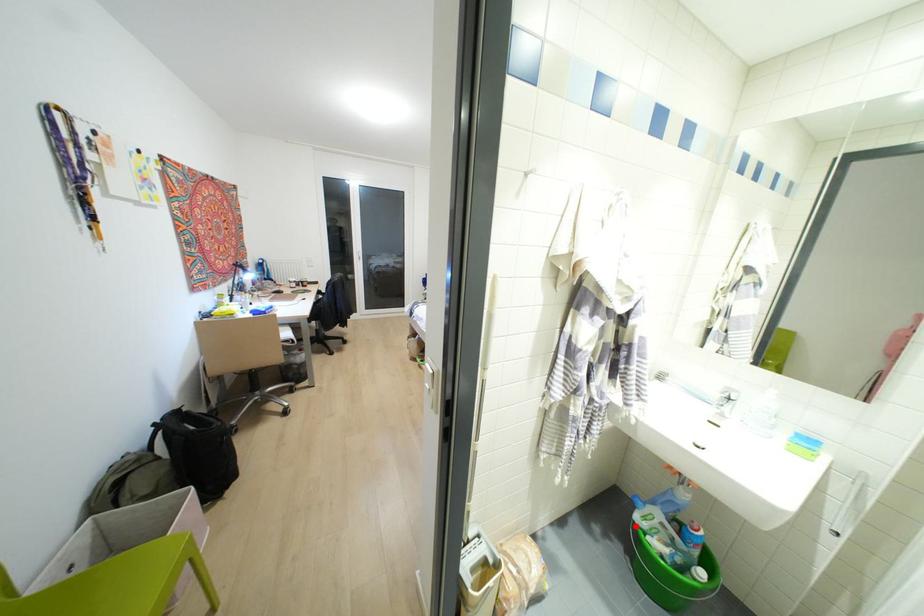
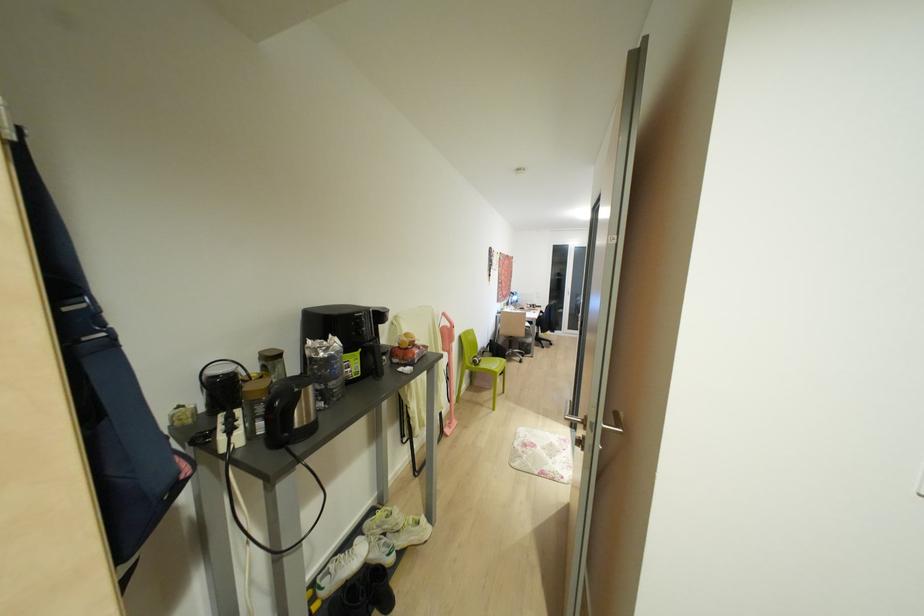
Question: I am providing you with two images of the same scene from different viewpoints. A red point is marked on the first image. Is the red point's position out of view in image 2?

Choices:
 (A) Yes
 (B) No

Answer: (A)